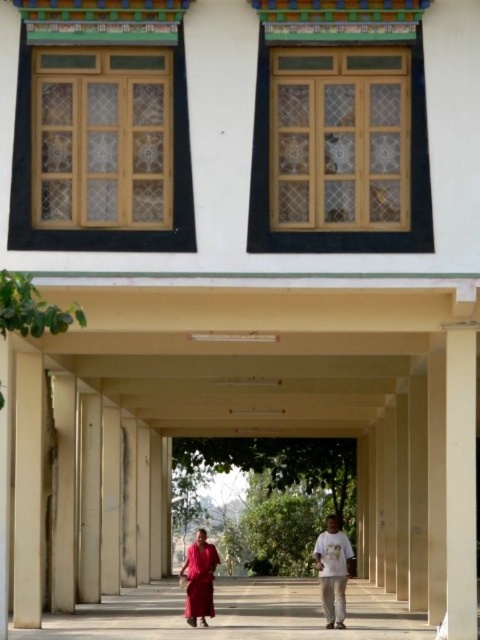
Question: Which of the following is the closest to the observer?

Choices:
 (A) white cotton shirt at lower center
 (B) smooth concrete walkway at center

Answer: (B)

Question: Does reddish-brown fabric robe at center have a larger size compared to white cotton shirt at lower center?

Choices:
 (A) yes
 (B) no

Answer: (A)

Question: Is white cotton shirt at lower center above matte red dress at lower center?

Choices:
 (A) yes
 (B) no

Answer: (A)

Question: Which object appears farthest from the camera in this image?

Choices:
 (A) white cotton shirt at lower center
 (B) smooth concrete walkway at center

Answer: (A)

Question: Which point appears farthest from the camera in this image?

Choices:
 (A) (268, 627)
 (B) (195, 611)
 (C) (333, 548)
 (D) (192, 548)

Answer: (A)

Question: Can you confirm if reddish-brown fabric robe at center is wider than white cotton shirt at lower center?

Choices:
 (A) yes
 (B) no

Answer: (A)